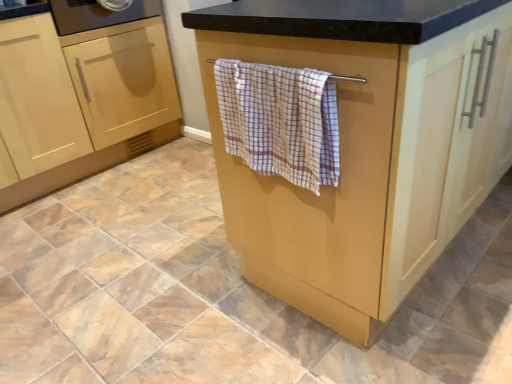
Question: From the image's perspective, does checkered cotton towel at center appear lower than light wood cabinet at left, the second cabinetry viewed from the left?

Choices:
 (A) yes
 (B) no

Answer: (A)

Question: Is checkered cotton towel at center next to light wood cabinet at left, the second cabinetry viewed from the left, and touching it?

Choices:
 (A) yes
 (B) no

Answer: (B)

Question: From a real-world perspective, is checkered cotton towel at center located beneath light wood cabinet at left, the 2th cabinetry from the right?

Choices:
 (A) yes
 (B) no

Answer: (B)

Question: Would you say light wood cabinet at left, the 2th cabinetry from the right, is part of checkered cotton towel at center's contents?

Choices:
 (A) yes
 (B) no

Answer: (B)

Question: Is checkered cotton towel at center to the left of light wood cabinet at left, the 2th cabinetry from the right, from the viewer's perspective?

Choices:
 (A) no
 (B) yes

Answer: (A)

Question: Considering the positions of light wood cabinet at lower left, the first cabinetry in the left-to-right sequence, and light wood cabinet at left, the second cabinetry viewed from the left, in the image, is light wood cabinet at lower left, the first cabinetry in the left-to-right sequence, wider or thinner than light wood cabinet at left, the second cabinetry viewed from the left,?

Choices:
 (A) wide
 (B) thin

Answer: (A)

Question: Choose the correct answer: Is light wood cabinet at lower left, the first cabinetry in the left-to-right sequence, inside light wood cabinet at left, the 2th cabinetry from the right, or outside it?

Choices:
 (A) inside
 (B) outside

Answer: (B)

Question: From the image's perspective, is light wood cabinet at lower left, arranged as the 3th cabinetry when viewed from the right, above or below light wood cabinet at left, the second cabinetry viewed from the left?

Choices:
 (A) below
 (B) above

Answer: (A)

Question: Is light wood cabinet at lower left, the first cabinetry in the left-to-right sequence, taller or shorter than light wood cabinet at left, the second cabinetry viewed from the left?

Choices:
 (A) tall
 (B) short

Answer: (B)

Question: From the image's perspective, is checkered cotton towel at center located above or below matte wood towel rack at center, marked as the 3th cabinetry in a left-to-right arrangement?

Choices:
 (A) above
 (B) below

Answer: (B)

Question: Is checkered cotton towel at center spatially inside matte wood towel rack at center, acting as the first cabinetry starting from the right, or outside of it?

Choices:
 (A) inside
 (B) outside

Answer: (B)

Question: Looking at their shapes, would you say checkered cotton towel at center is wider or thinner than matte wood towel rack at center, marked as the 3th cabinetry in a left-to-right arrangement?

Choices:
 (A) thin
 (B) wide

Answer: (A)

Question: Is checkered cotton towel at center in front of or behind matte wood towel rack at center, acting as the first cabinetry starting from the right, in the image?

Choices:
 (A) front
 (B) behind

Answer: (B)

Question: Would you say matte wood towel rack at center, acting as the first cabinetry starting from the right, is to the left or to the right of light wood cabinet at left, the 2th cabinetry from the right, in the picture?

Choices:
 (A) left
 (B) right

Answer: (B)

Question: Is matte wood towel rack at center, marked as the 3th cabinetry in a left-to-right arrangement, bigger or smaller than light wood cabinet at left, the second cabinetry viewed from the left?

Choices:
 (A) big
 (B) small

Answer: (A)